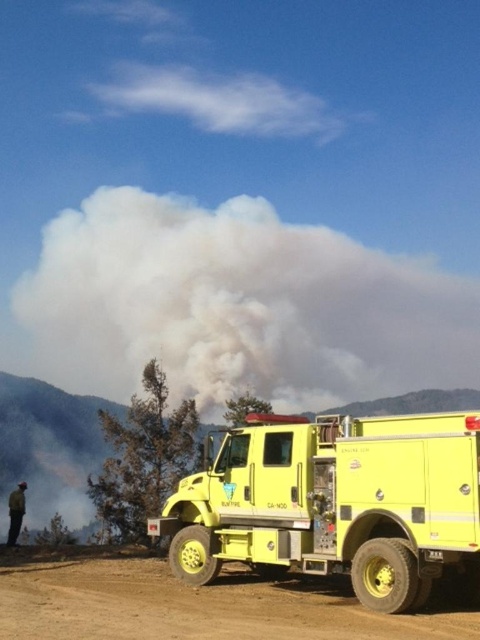
Does yellow matte fire truck at center have a larger size compared to camouflage jacket at lower left?

No.

Is yellow matte fire truck at center smaller than camouflage jacket at lower left?

Yes, yellow matte fire truck at center is smaller than camouflage jacket at lower left.

Where is `yellow matte fire truck at center`? The width and height of the screenshot is (480, 640). yellow matte fire truck at center is located at coordinates (335, 502).

Which of these two, brown dirt track at lower center or camouflage jacket at lower left, stands shorter?

brown dirt track at lower center is shorter.

Is point (323, 586) positioned behind point (12, 531)?

No.

What are the coordinates of `brown dirt track at lower center` in the screenshot? It's located at pyautogui.click(x=194, y=605).

How distant is yellow matte fire truck at center from brown dirt track at lower center?

yellow matte fire truck at center is 5.33 feet away from brown dirt track at lower center.

Is yellow matte fire truck at center shorter than brown dirt track at lower center?

No, yellow matte fire truck at center is not shorter than brown dirt track at lower center.

Which is in front, point (367, 486) or point (58, 609)?

Point (58, 609) is in front.

The height and width of the screenshot is (640, 480). I want to click on yellow matte fire truck at center, so click(x=335, y=502).